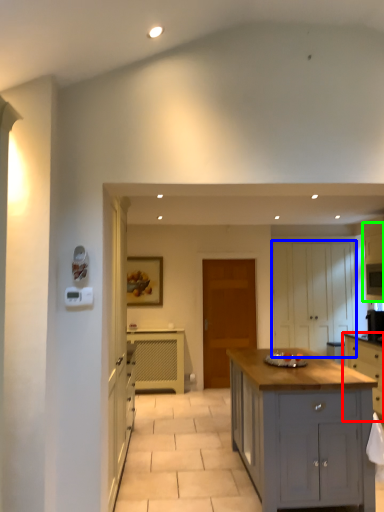
Question: Based on their relative distances, which object is nearer to cabinetry (highlighted by a red box)? Choose from cabinetry (highlighted by a blue box) and cabinetry (highlighted by a green box).

Choices:
 (A) cabinetry
 (B) cabinetry

Answer: (A)